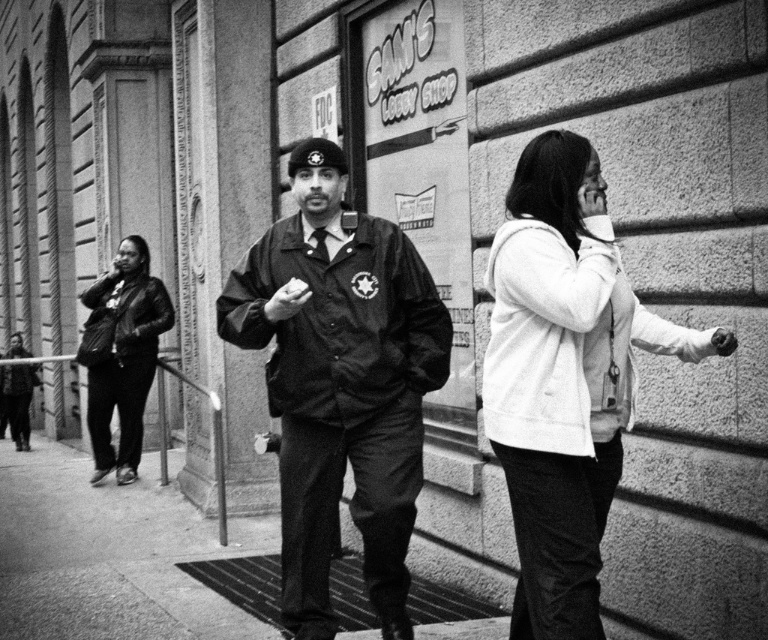
You are a delivery person trying to reach the entrance of Sam s Lobby Shop. You see the white matte jacket at center and the smooth concrete sidewalk at center. Which direction should you walk to reach the entrance?

The white matte jacket at center and the smooth concrete sidewalk at center are 4.55 meters apart from each other. Since the sidewalk is at the center, you should walk towards the smooth concrete sidewalk at center to reach the entrance of Sam s Lobby Shop.

You are standing on the smooth concrete sidewalk at center and want to approach the matte black uniform at center. In which direction should you move?

The matte black uniform at center is to the right of the smooth concrete sidewalk at center, so you should move to your right to approach it.